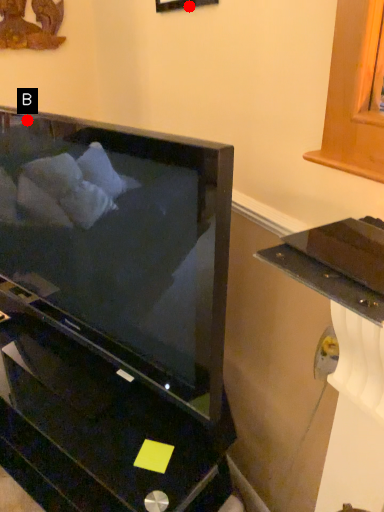
Question: Two points are circled on the image, labeled by A and B beside each circle. Which point appears closest to the camera in this image?

Choices:
 (A) A is closer
 (B) B is closer

Answer: (B)